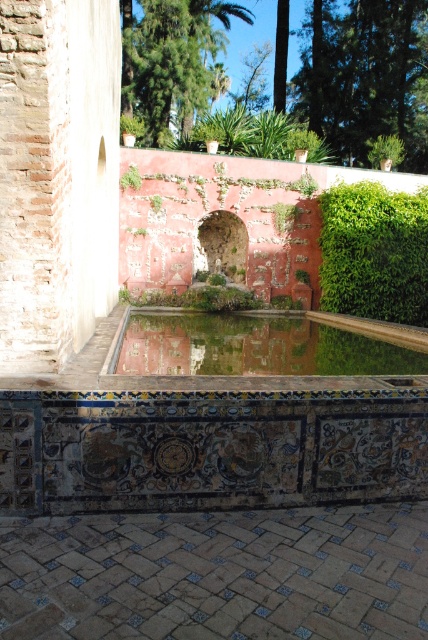
Is green mossy pool at center bigger than green leafy palm tree at upper center?

Incorrect, green mossy pool at center is not larger than green leafy palm tree at upper center.

Consider the image. Between green mossy pool at center and green leafy palm tree at upper center, which one has more height?

green leafy palm tree at upper center is taller.

Where is `green mossy pool at center`? The image size is (428, 640). green mossy pool at center is located at coordinates (255, 346).

Between decorative tile ledge at center and green leafy hedge at right, which one is positioned lower?

decorative tile ledge at center is lower down.

Locate an element on the screen. decorative tile ledge at center is located at coordinates coord(211,448).

Is the position of decorative tile ledge at center less distant than that of green leafy palm tree at upper center?

Yes, it is in front of green leafy palm tree at upper center.

Between decorative tile ledge at center and green leafy palm tree at upper center, which one appears on the left side from the viewer's perspective?

From the viewer's perspective, green leafy palm tree at upper center appears more on the left side.

Which is in front, point (250, 420) or point (202, 81)?

Point (250, 420)

The width and height of the screenshot is (428, 640). I want to click on decorative tile ledge at center, so (x=211, y=448).